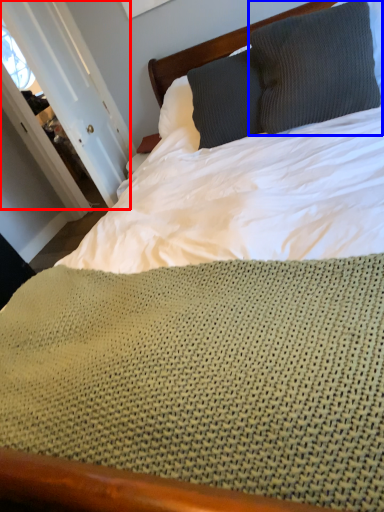
Question: Among these objects, which one is farthest to the camera, door (highlighted by a red box) or pillow (highlighted by a blue box)?

Choices:
 (A) door
 (B) pillow

Answer: (A)